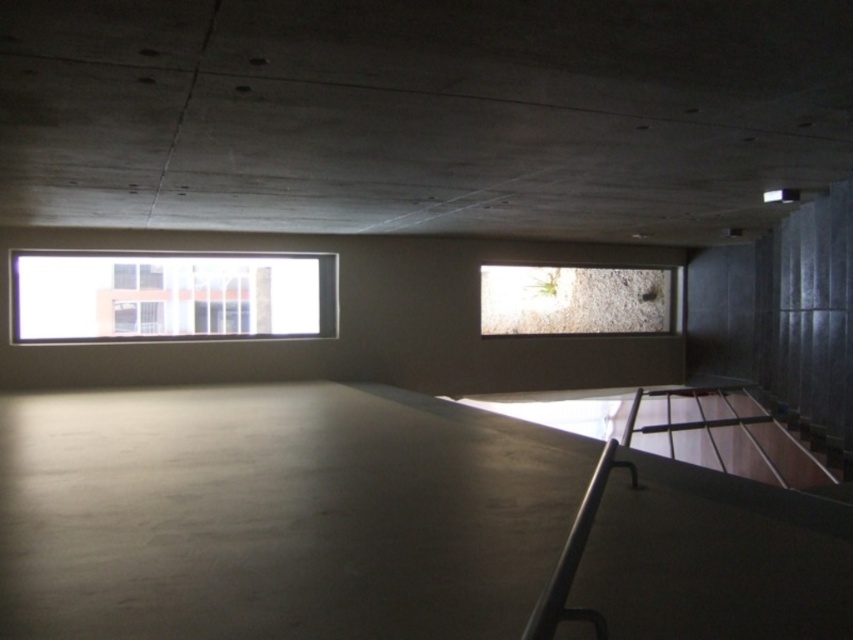
Question: Can you confirm if smooth concrete floor at center is positioned above transparent glass window at upper left?

Choices:
 (A) no
 (B) yes

Answer: (A)

Question: Which point is farther to the camera?

Choices:
 (A) transparent glass window at upper left
 (B) clear glass window at center
 (C) smooth concrete floor at center

Answer: (B)

Question: Which point appears closest to the camera in this image?

Choices:
 (A) (784, 572)
 (B) (15, 272)

Answer: (A)

Question: Which of the following is the closest to the observer?

Choices:
 (A) (550, 307)
 (B) (819, 541)

Answer: (B)

Question: From the image, what is the correct spatial relationship of transparent glass window at upper left in relation to clear glass window at center?

Choices:
 (A) below
 (B) above

Answer: (B)

Question: Is smooth concrete floor at center positioned in front of transparent glass window at upper left?

Choices:
 (A) yes
 (B) no

Answer: (A)